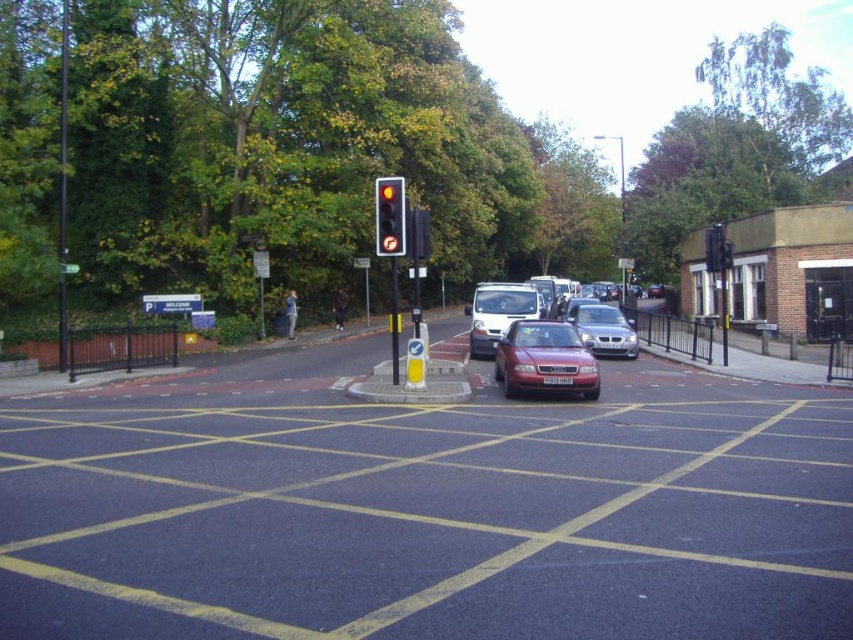
You are a pedestrian waiting to cross the street. You see the shiny red car at center and the red glass traffic light at center. Which object is closer to you?

The shiny red car at center is closer to you because it is positioned under the red glass traffic light at center, meaning the car is in front of the traffic light.

You are a delivery driver who needs to park your truck, which is 2.5 meters wide, in this scene. You see the shiny red car at center and the metallic silver car at center. Can your truck fit between them if they are parked side by side?

The shiny red car at center is narrower than the metallic silver car at center. However, without knowing the exact spacing between them or the total available width, it is impossible to determine if the truck can fit. Additional information about the distance between the cars or the total parking space width is needed to answer this question accurately.

You are driving a shiny red sedan at center that is 1.8 meters wide. You want to parallel park into a space that is 2.5 meters wide. Can you fit your car into the space without hitting the metallic silver car at center?

The shiny red sedan at center is 2.44 meters from the metallic silver car at center. Since the parking space is 2.5 meters wide and your car is 1.8 meters wide, there is enough space to park without hitting the metallic silver car at center. However, you must ensure precise maneuvering to stay within the 2.44 meters gap between the two cars.